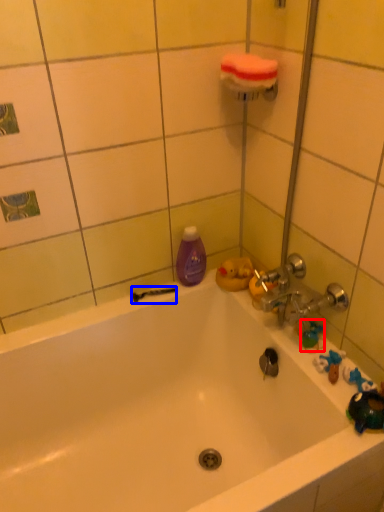
Question: Which point is further to the camera, toy (highlighted by a red box) or shower (highlighted by a blue box)?

Choices:
 (A) toy
 (B) shower

Answer: (B)